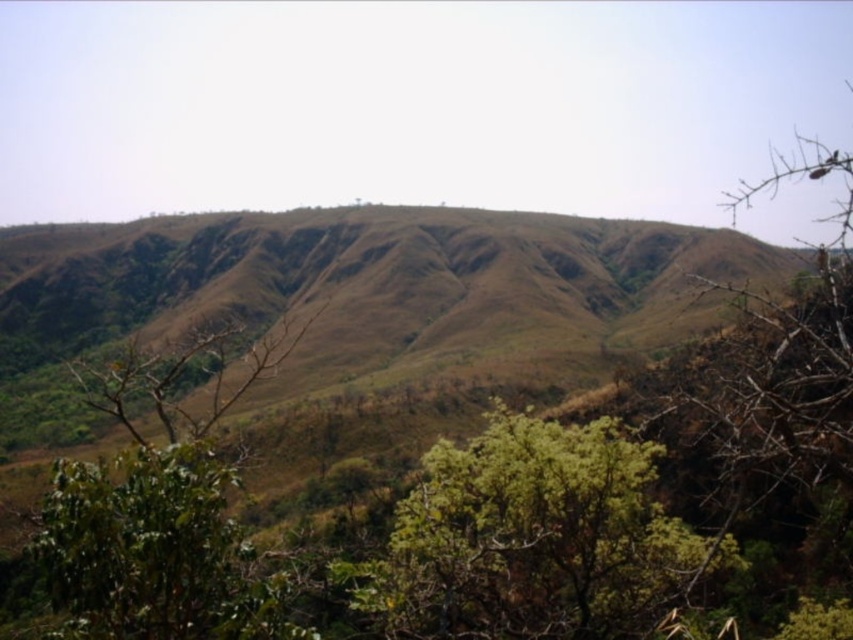
Which is above, green leafy tree at center or green leafy tree at lower left?

green leafy tree at lower left is above.

Does green leafy tree at center come in front of green leafy tree at lower left?

No.

You are a GUI agent. You are given a task and a screenshot of the screen. Output one action in this format:
    pyautogui.click(x=<x>, y=<y>)
    Task: Click on the green leafy tree at center
    
    Given the screenshot: What is the action you would take?
    pyautogui.click(x=535, y=538)

Identify the location of green leafy tree at center. (535, 538).

Consider the image. Who is taller, brown grassy hillside at center or green leafy tree at lower left?

brown grassy hillside at center

How far apart are brown grassy hillside at center and green leafy tree at lower left?

brown grassy hillside at center and green leafy tree at lower left are 281.99 meters apart.

In order to click on brown grassy hillside at center in this screenshot , I will do `click(364, 292)`.

This screenshot has height=640, width=853. Identify the location of brown grassy hillside at center. (364, 292).

Does brown grassy hillside at center appear over green leafy tree at center?

Yes.

Does brown grassy hillside at center appear on the left side of green leafy tree at center?

Yes, brown grassy hillside at center is to the left of green leafy tree at center.

Between point (461, 285) and point (601, 429), which one is positioned in front?

Point (601, 429)

Locate an element on the screen. This screenshot has width=853, height=640. brown grassy hillside at center is located at coordinates (364, 292).